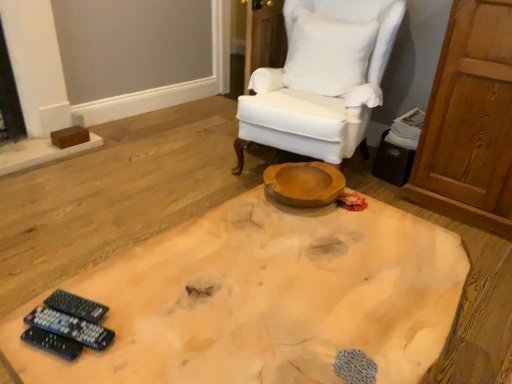
Identify the location of vacant space in front of black plastic remote controls at lower left, the 1th remote control viewed from the back. This screenshot has width=512, height=384. (62, 362).